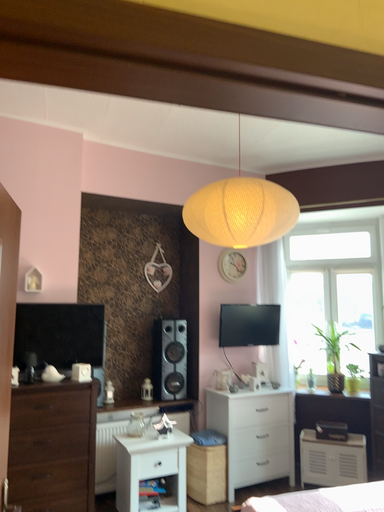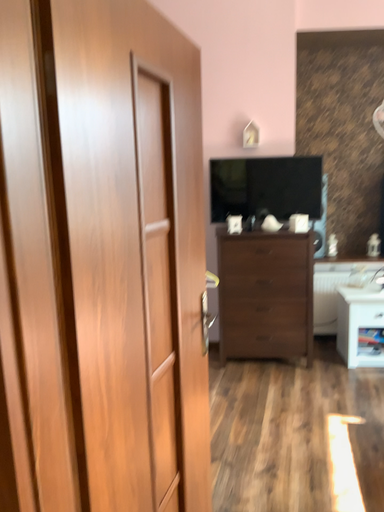
Question: Which way did the camera rotate in the video?

Choices:
 (A) rotated left
 (B) rotated right

Answer: (A)